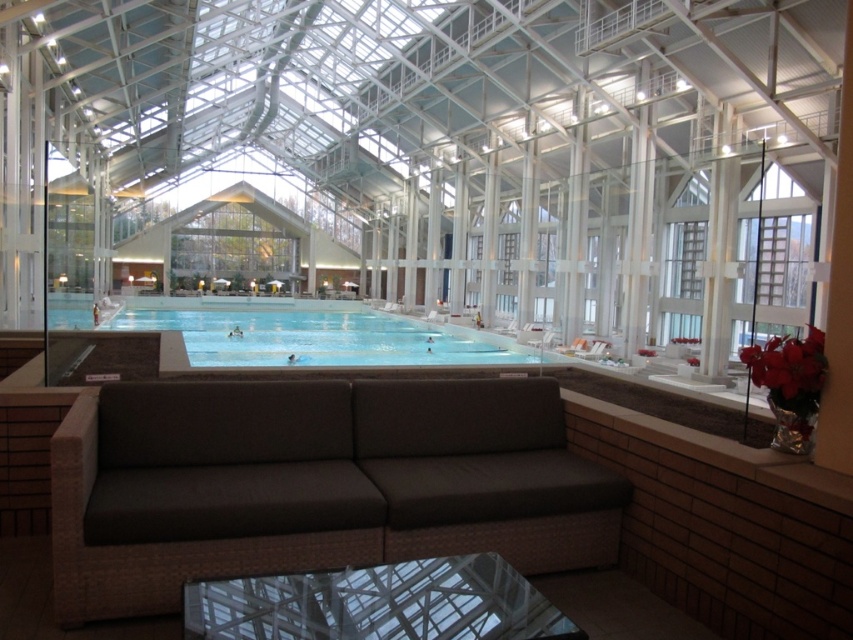
Who is shorter, transparent glass table at lower center or clear blue water at center?

transparent glass table at lower center

Is transparent glass table at lower center to the left of clear blue water at center from the viewer's perspective?

In fact, transparent glass table at lower center is to the right of clear blue water at center.

Which is behind, point (532, 595) or point (178, 308)?

The point (178, 308) is more distant.

Find the location of `transparent glass table at lower center`. transparent glass table at lower center is located at coordinates (378, 604).

Which is more to the right, brown wicker couch at lower center or clear blue water at center?

brown wicker couch at lower center is more to the right.

Is brown wicker couch at lower center to the right of clear blue water at center from the viewer's perspective?

Indeed, brown wicker couch at lower center is positioned on the right side of clear blue water at center.

Which is in front, point (248, 554) or point (245, 310)?

Point (248, 554)

Locate an element on the screen. The height and width of the screenshot is (640, 853). brown wicker couch at lower center is located at coordinates (312, 483).

Which is more to the right, brown wicker couch at lower center or transparent glass table at lower center?

From the viewer's perspective, transparent glass table at lower center appears more on the right side.

Is brown wicker couch at lower center to the right of transparent glass table at lower center from the viewer's perspective?

No, brown wicker couch at lower center is not to the right of transparent glass table at lower center.

Measure the distance between brown wicker couch at lower center and camera.

They are 9.47 feet apart.

The width and height of the screenshot is (853, 640). Find the location of `brown wicker couch at lower center`. brown wicker couch at lower center is located at coordinates (312, 483).